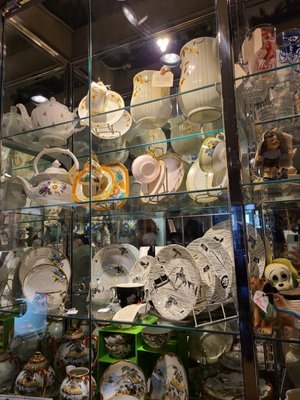
The height and width of the screenshot is (400, 300). I want to click on wall above shelves, so click(x=135, y=23).